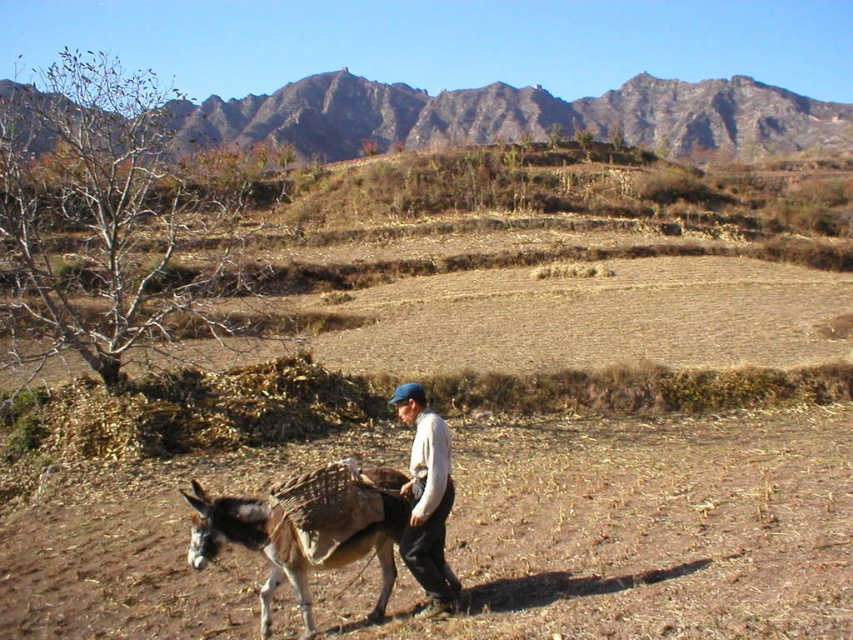
Question: Does brown grassy hillside at upper center lie in front of brown textured donkey at lower left?

Choices:
 (A) no
 (B) yes

Answer: (A)

Question: Considering the relative positions of brown grassy hillside at upper center and brown textured donkey at lower left in the image provided, where is brown grassy hillside at upper center located with respect to brown textured donkey at lower left?

Choices:
 (A) right
 (B) left

Answer: (A)

Question: Is brown grassy hillside at upper center below brown textured donkey at lower left?

Choices:
 (A) yes
 (B) no

Answer: (B)

Question: Estimate the real-world distances between objects in this image. Which object is farther from the brown textured donkey at lower left?

Choices:
 (A) brown grassy hillside at upper center
 (B) white cotton shirt at center

Answer: (A)

Question: Which point is closer to the camera?

Choices:
 (A) (260, 518)
 (B) (717, 83)

Answer: (A)

Question: Among these objects, which one is farthest from the camera?

Choices:
 (A) brown textured donkey at lower left
 (B) white cotton shirt at center
 (C) brown grassy hillside at upper center

Answer: (C)